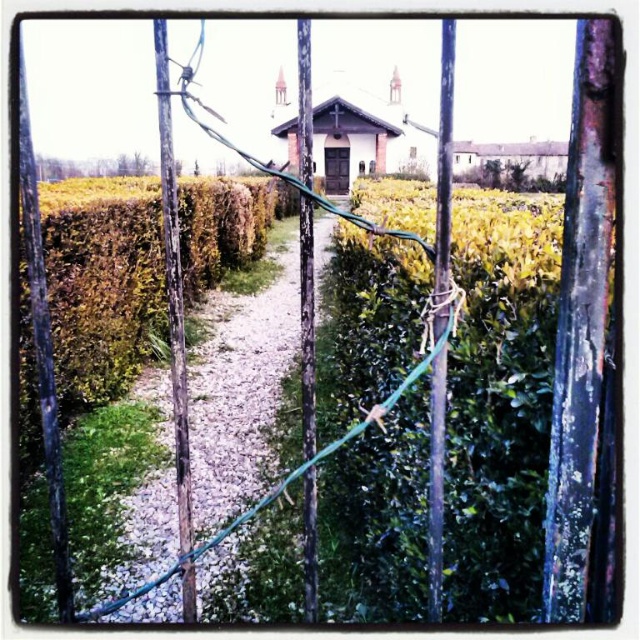
You are a gardener planning to walk along the green gravel path at center. You want to know if the green leafy hedge at center is wider than the path itself. Can you confirm this?

The green leafy hedge at center is wider than the green gravel path at center, so yes, the hedge is wider than the path.

You are standing outside the gate and want to walk along the path towards the building. Which side of the green gravel path at center should you walk on to stay closest to the green leafy hedge at center?

You should walk on the left side of the green gravel path at center because the green leafy hedge at center is located to the left of the path, so staying on that side will keep you closer to the hedge.